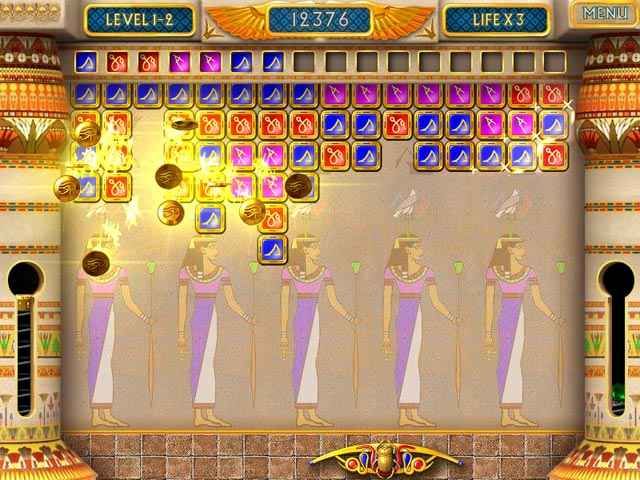
This screenshot has height=480, width=640. Find the location of `column on right`. column on right is located at coordinates (623, 214).